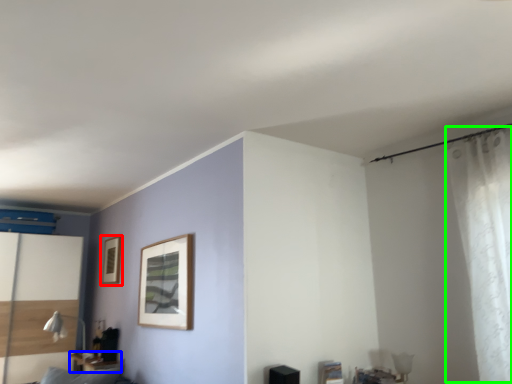
Question: Which object is the farthest from picture frame (highlighted by a red box)? Choose among these: table (highlighted by a blue box) or curtain (highlighted by a green box).

Choices:
 (A) table
 (B) curtain

Answer: (B)